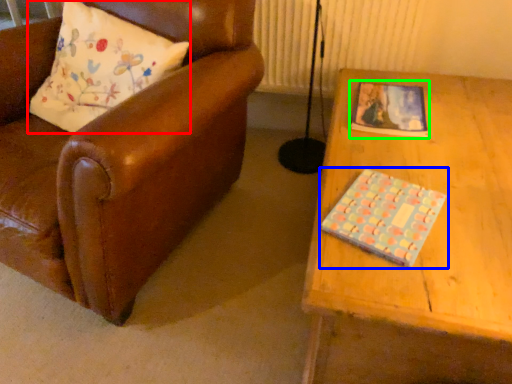
Question: Estimate the real-world distances between objects in this image. Which object is closer to pillow (highlighted by a red box), book (highlighted by a blue box) or book (highlighted by a green box)?

Choices:
 (A) book
 (B) book

Answer: (B)